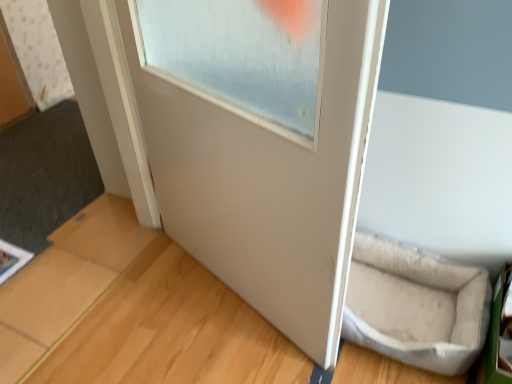
What are the coordinates of `blank area beneath white matte door at center (from a real-world perspective)` in the screenshot? It's located at (224, 292).